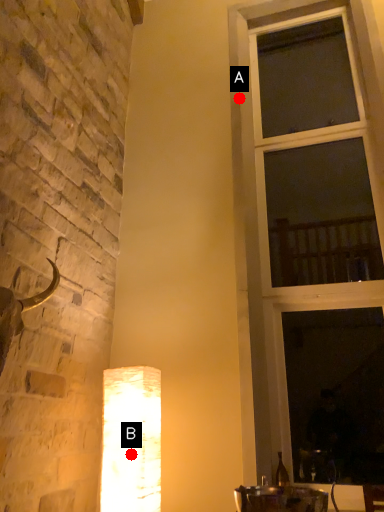
Question: Two points are circled on the image, labeled by A and B beside each circle. Which point is closer to the camera?

Choices:
 (A) A is closer
 (B) B is closer

Answer: (B)